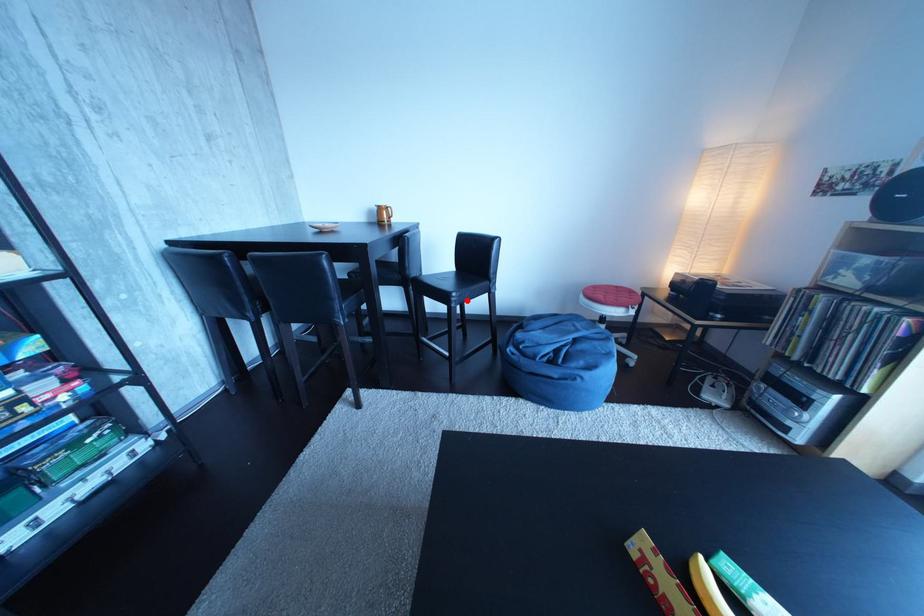
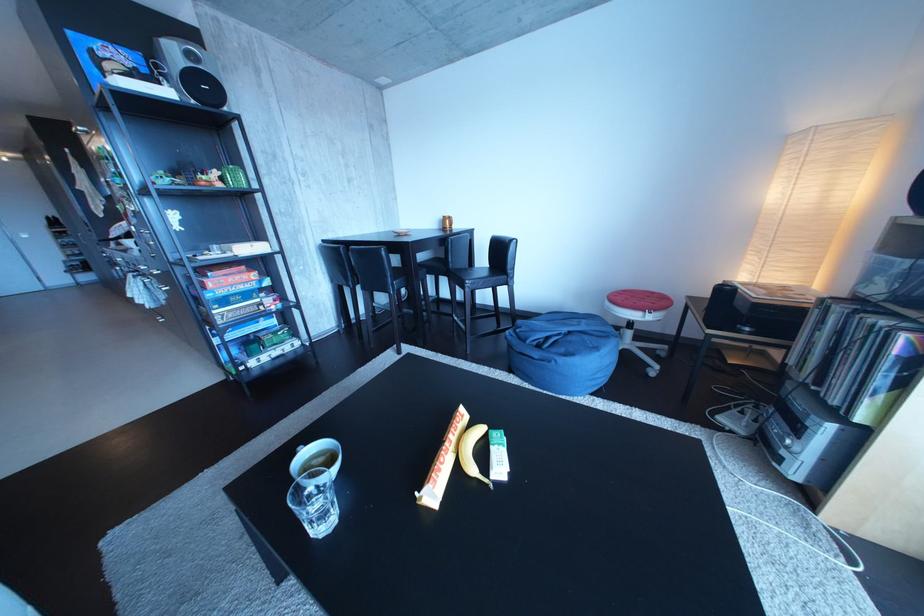
Locate, in the second image, the point that corresponds to the highlighted location in the first image.

(480, 286)